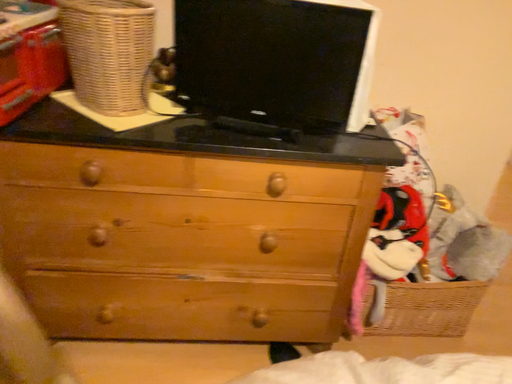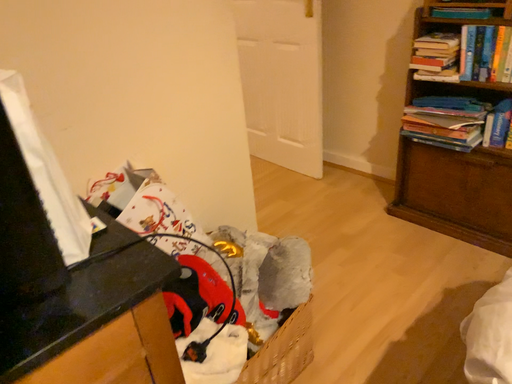
Question: How did the camera likely rotate when shooting the video?

Choices:
 (A) rotated right
 (B) rotated left

Answer: (A)